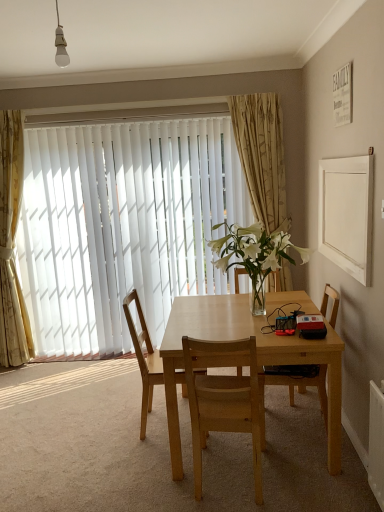
At what (x,y) coordinates should I click in order to perform the action: click on vacant space situated on the left part of light wood table at center. Please return your answer as a coordinate pair (x, y). Looking at the image, I should click on (114, 438).